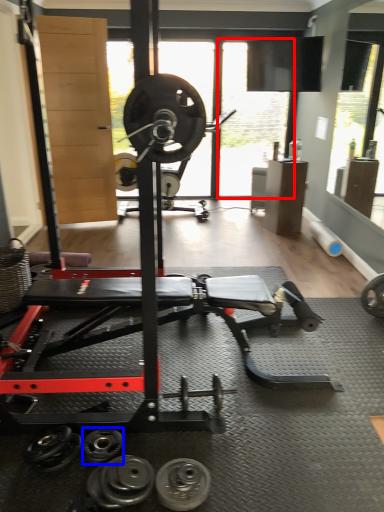
Question: Among these objects, which one is nearest to the camera, window screen (highlighted by a red box) or dumbbell (highlighted by a blue box)?

Choices:
 (A) window screen
 (B) dumbbell

Answer: (B)